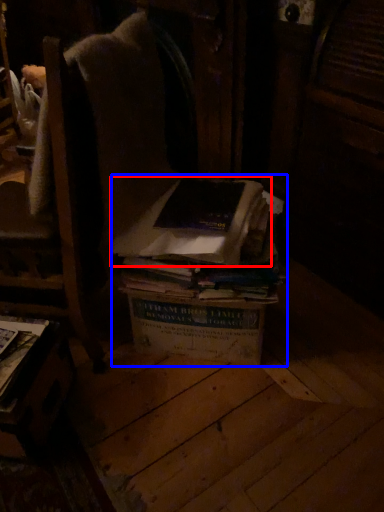
Question: Among these objects, which one is nearest to the camera, book (highlighted by a red box) or book (highlighted by a blue box)?

Choices:
 (A) book
 (B) book

Answer: (A)